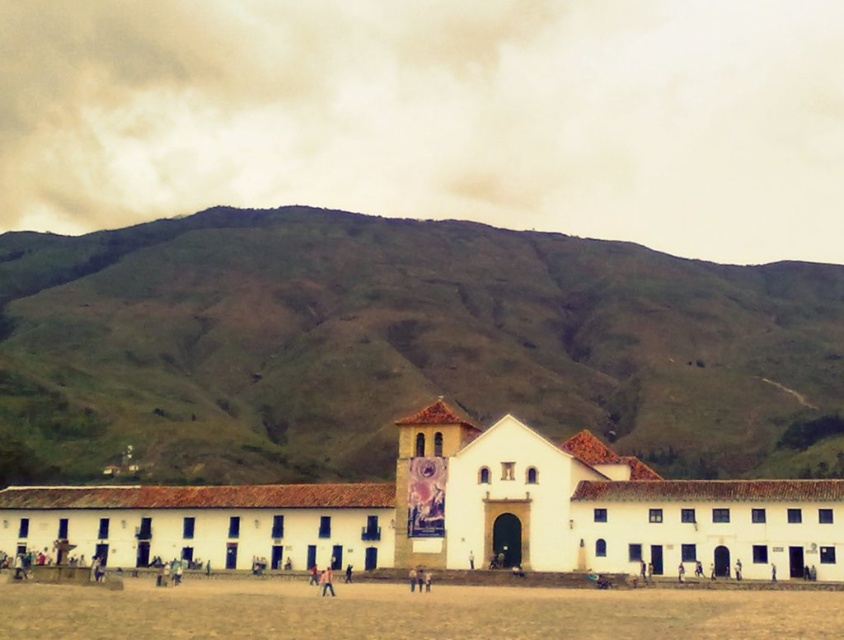
Does green grassy hill at upper center have a lesser width compared to brown sandy dirt field at lower center?

In fact, green grassy hill at upper center might be wider than brown sandy dirt field at lower center.

Which of these two, green grassy hill at upper center or brown sandy dirt field at lower center, stands taller?

Standing taller between the two is green grassy hill at upper center.

Locate an element on the screen. green grassy hill at upper center is located at coordinates (398, 346).

Which is below, white matte building at center or light brown leather jacket at center?

light brown leather jacket at center is below.

Is point (594, 486) positioned after point (320, 588)?

Yes, point (594, 486) is farther from viewer.

Is point (111, 506) farther from viewer compared to point (325, 592)?

Yes, point (111, 506) is behind point (325, 592).

Identify the location of white matte building at center. (457, 513).

Measure the distance between green grassy hill at upper center and camera.

The distance of green grassy hill at upper center from camera is 362.12 feet.

Between green grassy hill at upper center and white matte building at center, which one has less height?

With less height is white matte building at center.

You are a GUI agent. You are given a task and a screenshot of the screen. Output one action in this format:
    pyautogui.click(x=<x>, y=<y>)
    Task: Click on the green grassy hill at upper center
    
    Given the screenshot: What is the action you would take?
    pyautogui.click(x=398, y=346)

Locate an element on the screen. green grassy hill at upper center is located at coordinates (398, 346).